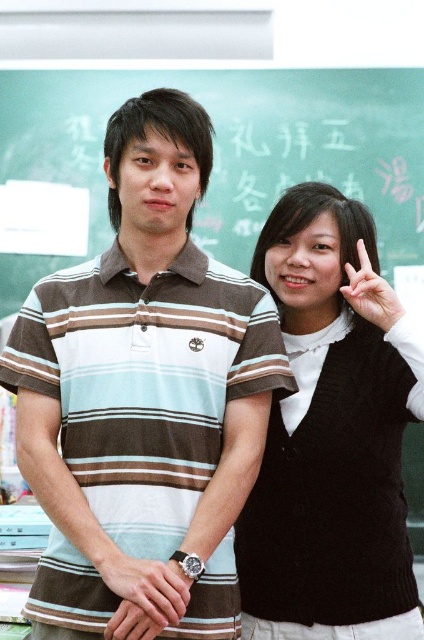
Question: Which point is closer to the camera taking this photo?

Choices:
 (A) (120, 625)
 (B) (379, 300)

Answer: (A)

Question: Is brown striped polo shirt at center in front of green chalkboard at upper center?

Choices:
 (A) yes
 (B) no

Answer: (A)

Question: Is brown striped polo shirt at center smaller than green chalkboard at upper center?

Choices:
 (A) no
 (B) yes

Answer: (B)

Question: Which point is closer to the camera?

Choices:
 (A) brown striped polo shirt at center
 (B) matte black hand at center
 (C) black knitted vest at right
 (D) green chalkboard at upper center

Answer: (A)

Question: Which object is closer to the camera taking this photo?

Choices:
 (A) green chalkboard at upper center
 (B) matte brown watch at center

Answer: (B)

Question: Is green chalkboard at upper center bigger than matte black hand at center?

Choices:
 (A) no
 (B) yes

Answer: (B)